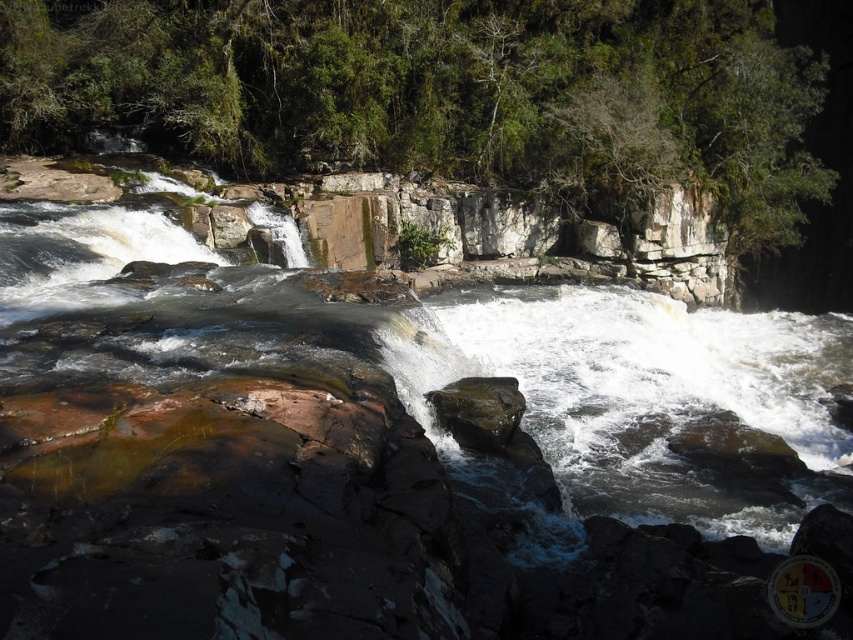
Which is below, green leafy tree at upper center or rusty rock at center?

rusty rock at center is lower down.

From the picture: Can you confirm if green leafy tree at upper center is positioned to the left of rusty rock at center?

Incorrect, green leafy tree at upper center is not on the left side of rusty rock at center.

What do you see at coordinates (440, 93) in the screenshot?
I see `green leafy tree at upper center` at bounding box center [440, 93].

What are the coordinates of `green leafy tree at upper center` in the screenshot? It's located at (440, 93).